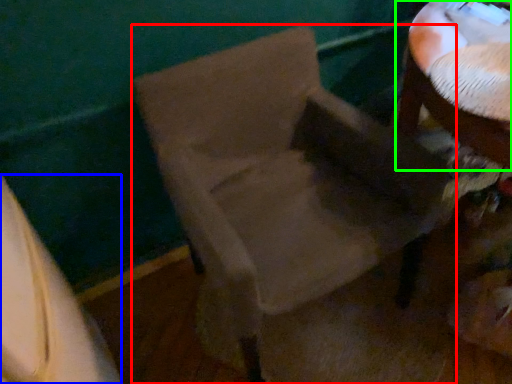
Question: Which is nearer to the chair (highlighted by a red box)? leftover (highlighted by a blue box) or table (highlighted by a green box).

Choices:
 (A) leftover
 (B) table

Answer: (B)